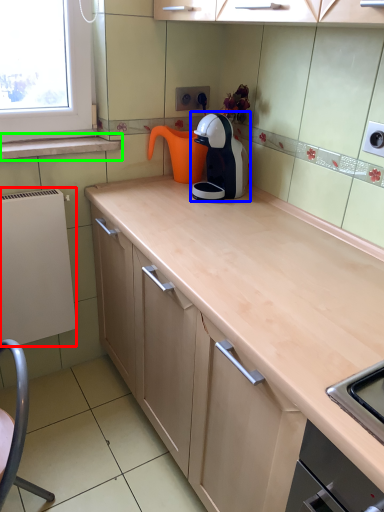
Question: Which object is the closest to the appliance (highlighted by a red box)? Choose among these: kitchen appliance (highlighted by a blue box) or window sill (highlighted by a green box).

Choices:
 (A) kitchen appliance
 (B) window sill

Answer: (B)